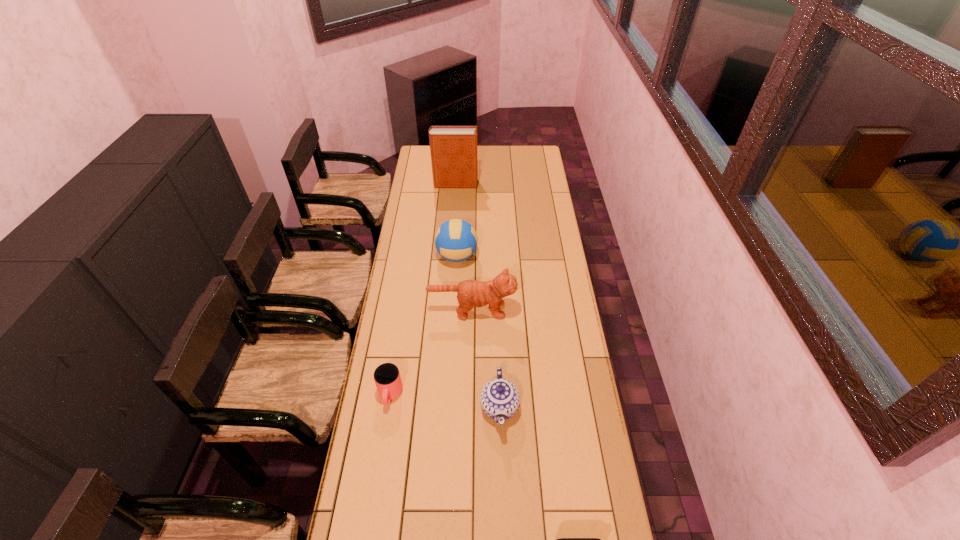
Locate an element on the screen. The height and width of the screenshot is (540, 960). the farthest object is located at coordinates (453, 149).

The width and height of the screenshot is (960, 540). I want to click on the tallest object, so [x=453, y=149].

Locate an element on the screen. The width and height of the screenshot is (960, 540). cat is located at coordinates point(471,293).

This screenshot has width=960, height=540. Identify the location of the second farthest object. (456, 240).

The width and height of the screenshot is (960, 540). What are the coordinates of `chinaware` in the screenshot? It's located at (499, 399).

Identify the location of cup. (387, 378).

This screenshot has width=960, height=540. What are the coordinates of `the shortest object` in the screenshot? It's located at (387, 378).

What are the coordinates of `vacant space located on the open cover of the hardback book` in the screenshot? It's located at (525, 184).

Image resolution: width=960 pixels, height=540 pixels. Find the location of `vacant space located on the face of the third farthest object`. vacant space located on the face of the third farthest object is located at coordinates [x=542, y=310].

Image resolution: width=960 pixels, height=540 pixels. Identify the location of vacant area situated 0.250m on the front of the volleyball. (454, 314).